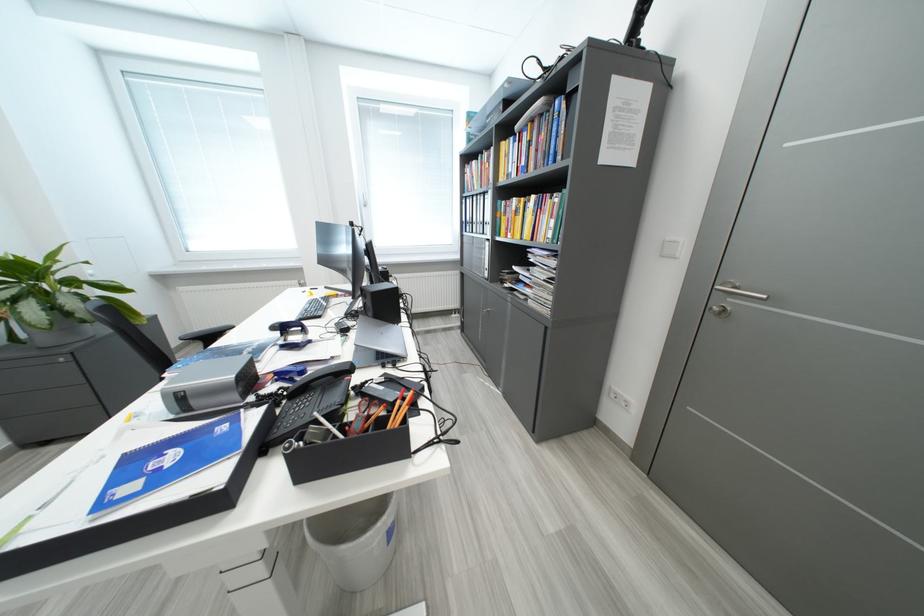
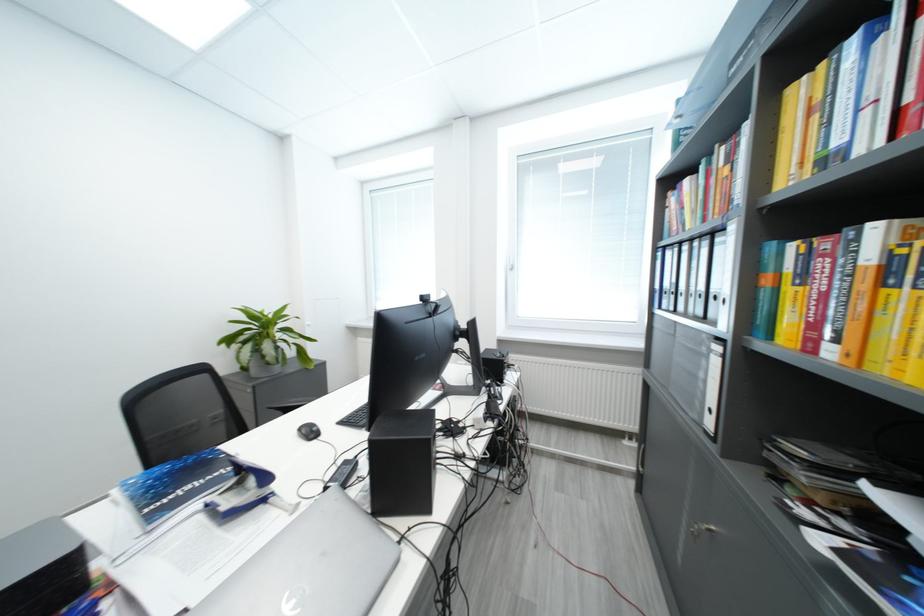
The point at (482, 166) is marked in the first image. Where is the corresponding point in the second image?

(696, 184)